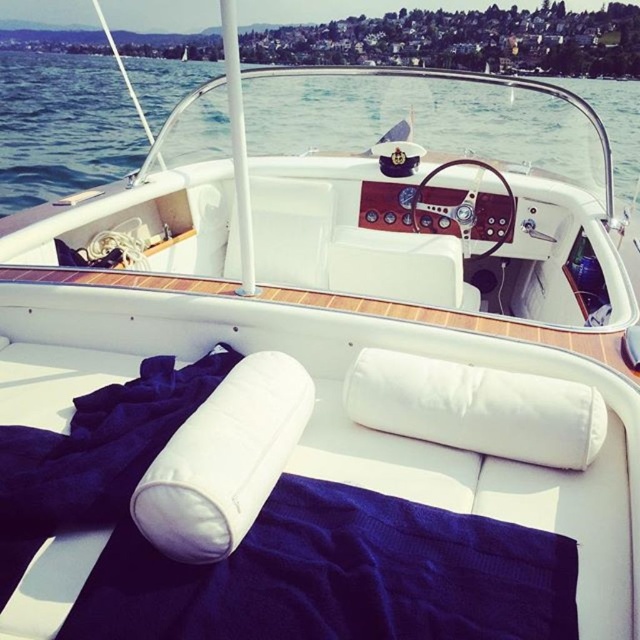
Is the position of transparent water at center more distant than that of white fabric pillow at center?

Yes, it is.

Image resolution: width=640 pixels, height=640 pixels. What do you see at coordinates (61, 125) in the screenshot?
I see `transparent water at center` at bounding box center [61, 125].

What are the coordinates of `transparent water at center` in the screenshot? It's located at click(x=61, y=125).

Identify the location of transparent water at center. This screenshot has height=640, width=640. (61, 125).

Is white soft pillow at center thinner than white fabric pillow at center?

Yes, white soft pillow at center is thinner than white fabric pillow at center.

Who is positioned more to the right, white soft pillow at center or white fabric pillow at center?

Positioned to the right is white fabric pillow at center.

Between point (285, 449) and point (387, 401), which one is positioned behind?

Positioned behind is point (387, 401).

Where is `white soft pillow at center`? white soft pillow at center is located at coordinates (224, 460).

Does point (81, 160) come closer to viewer compared to point (227, 554)?

No, it is not.

Based on the photo, does transparent water at center have a smaller size compared to white soft pillow at center?

Incorrect, transparent water at center is not smaller in size than white soft pillow at center.

Is point (92, 147) behind point (145, 499)?

Yes.

Locate an element on the screen. transparent water at center is located at coordinates (61, 125).